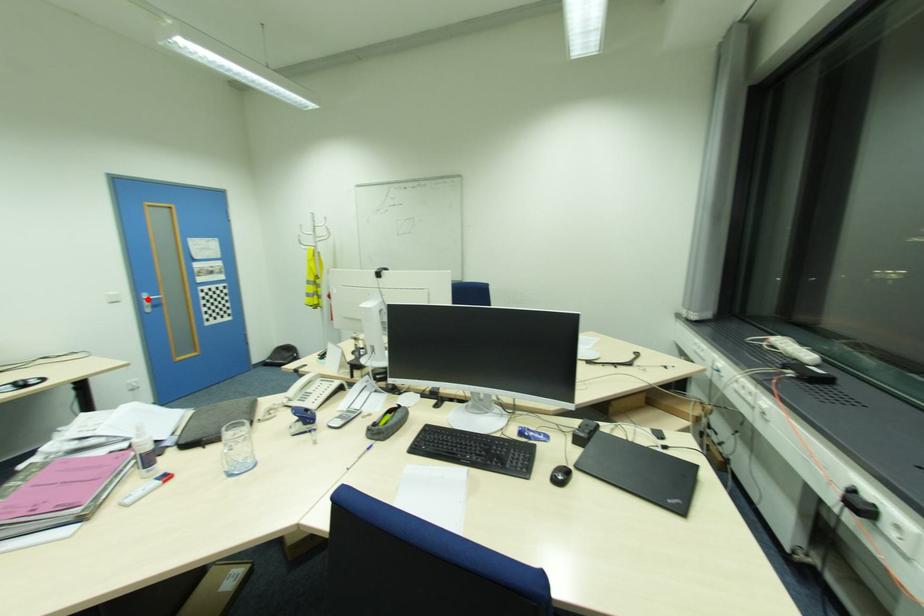
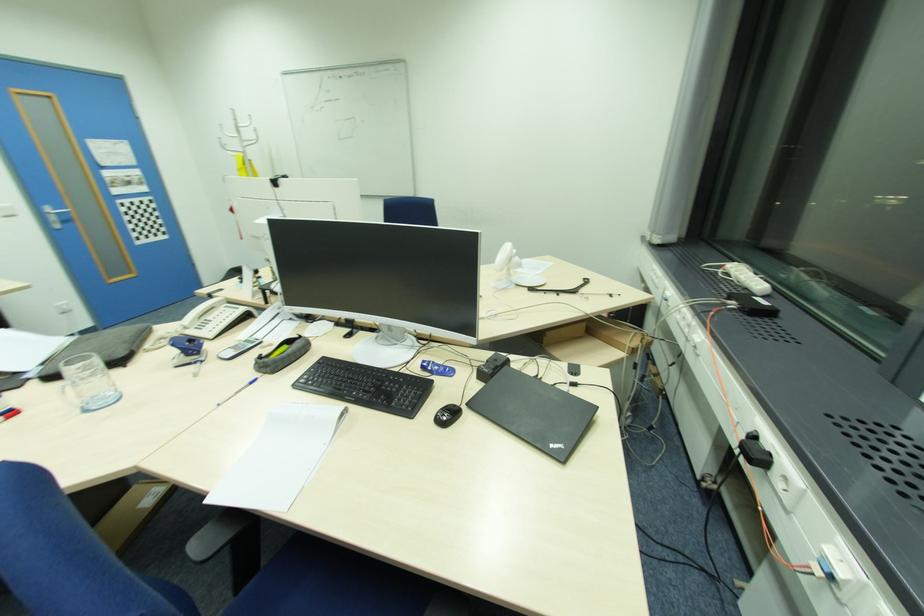
Locate, in the second image, the point that corresponds to the highlighted location in the first image.

(54, 213)